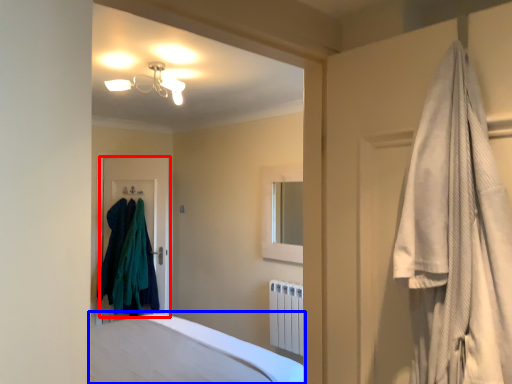
Question: Which object is further to the camera taking this photo, door (highlighted by a red box) or bed (highlighted by a blue box)?

Choices:
 (A) door
 (B) bed

Answer: (A)